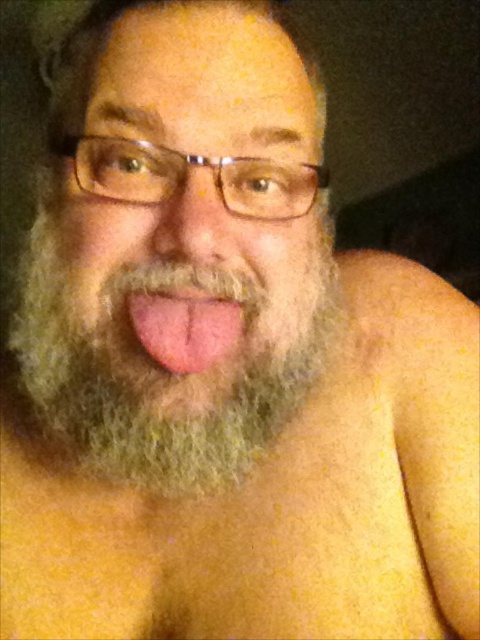
In the scene shown: You are a photographer adjusting the focus on a camera. You have two points to focus on in the image, point (152,346) and point (170,310). Which point should you focus on first if you want to capture the subject in the foreground?

Point (152,346) is in front of point (170,310), so you should focus on point (152,346) first to capture the subject in the foreground.